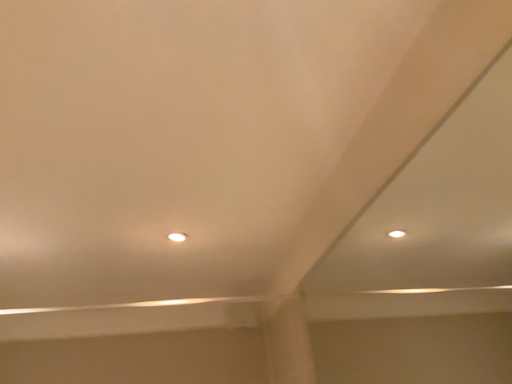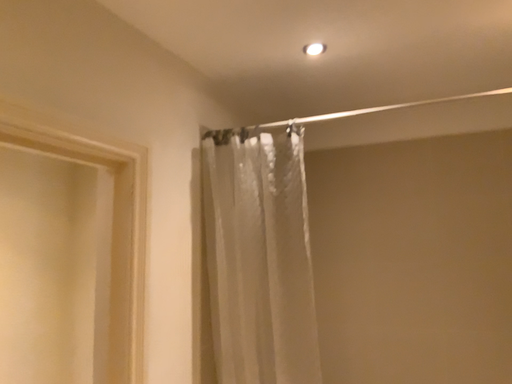
Question: Which way did the camera rotate in the video?

Choices:
 (A) rotated downward
 (B) rotated upward

Answer: (A)